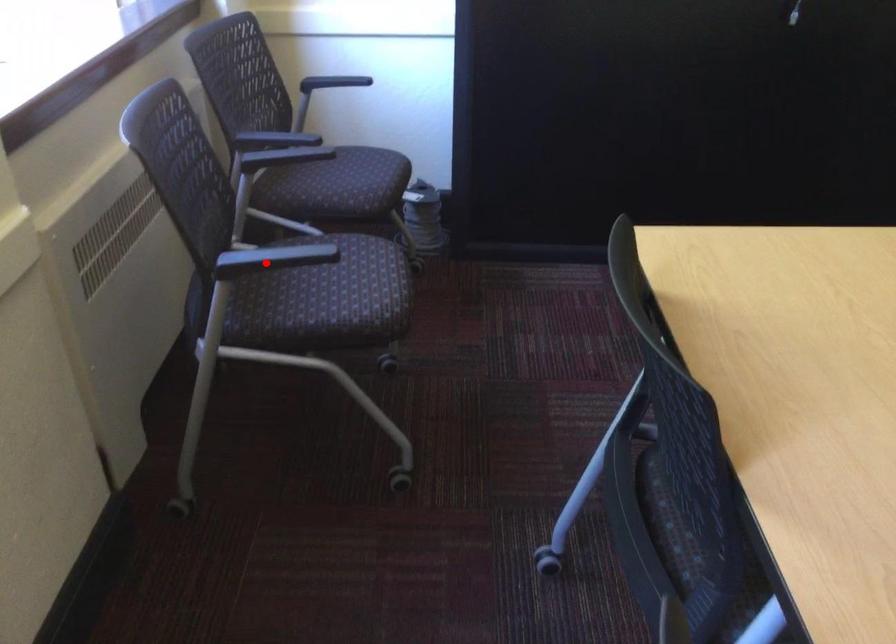
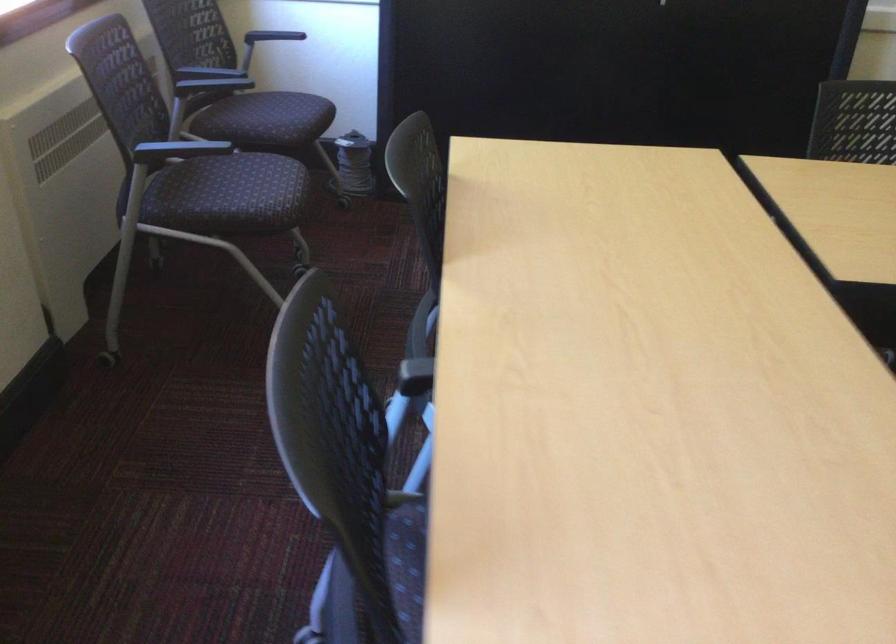
Locate, in the second image, the point that corresponds to the highlighted location in the first image.

(176, 149)